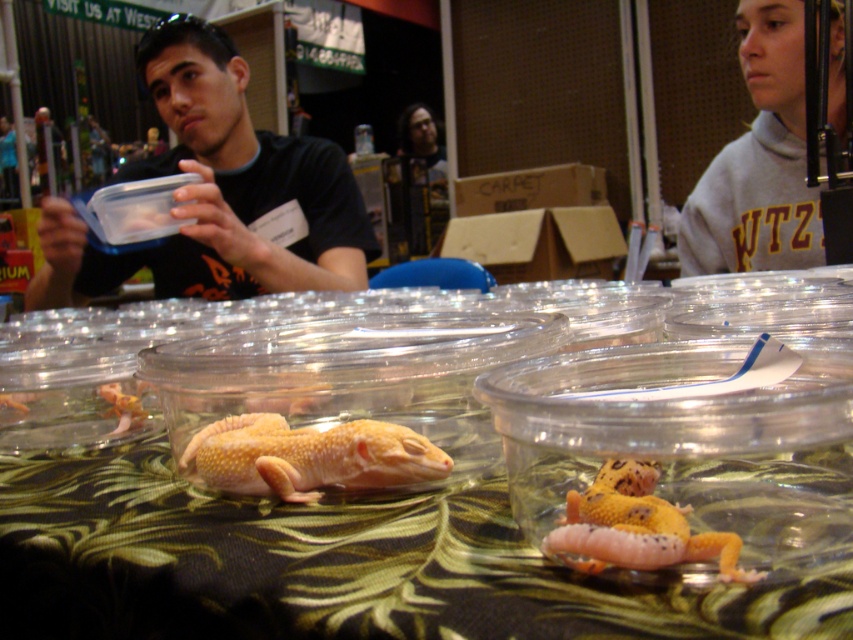
Question: Estimate the real-world distances between objects in this image. Which object is farther from the matte black shirt at upper left?

Choices:
 (A) yellow matte lizard at center
 (B) gray fleece sweatshirt at upper right

Answer: (A)

Question: Which point is closer to the camera?

Choices:
 (A) yellow matte lizard at center
 (B) matte black shirt at upper left
 (C) yellowish matte lizard at center
 (D) gray fleece sweatshirt at upper right

Answer: (A)

Question: Where is matte black shirt at upper left located in relation to yellowish matte lizard at center in the image?

Choices:
 (A) below
 (B) above

Answer: (B)

Question: Is gray fleece sweatshirt at upper right positioned behind yellow matte lizard at center?

Choices:
 (A) yes
 (B) no

Answer: (A)

Question: Does gray fleece sweatshirt at upper right have a larger size compared to yellowish matte lizard at center?

Choices:
 (A) no
 (B) yes

Answer: (B)

Question: Which object appears closest to the camera in this image?

Choices:
 (A) yellow matte lizard at center
 (B) gray fleece sweatshirt at upper right

Answer: (A)